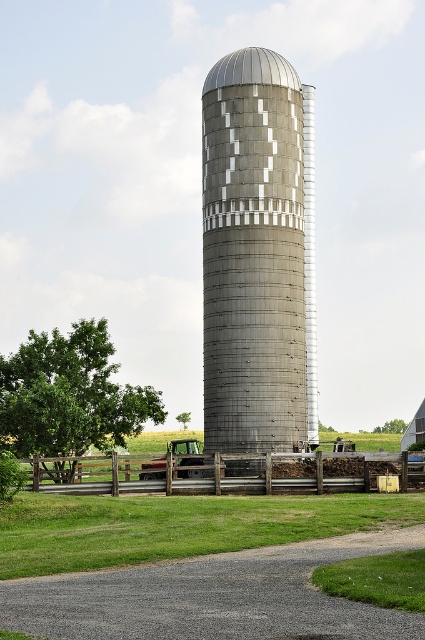
Does point (272, 202) come behind point (234, 472)?

Yes, point (272, 202) is behind point (234, 472).

Consider the image. Is gray metallic silo at center thinner than wooden fence at lower center?

Yes, gray metallic silo at center is thinner than wooden fence at lower center.

Which is behind, point (303, 394) or point (218, 454)?

Point (303, 394)

Image resolution: width=425 pixels, height=640 pixels. Find the location of `gray metallic silo at center`. gray metallic silo at center is located at coordinates (257, 256).